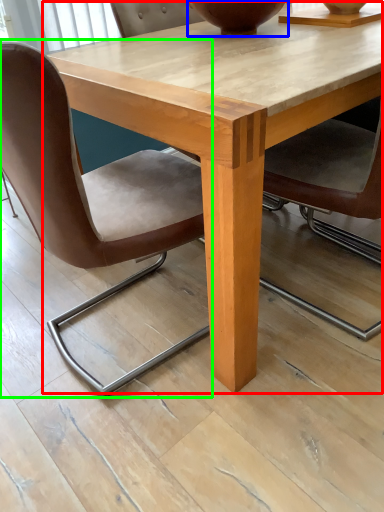
Question: Which is nearer to the coffee table (highlighted by a red box)? vase (highlighted by a blue box) or chair (highlighted by a green box).

Choices:
 (A) vase
 (B) chair

Answer: (B)